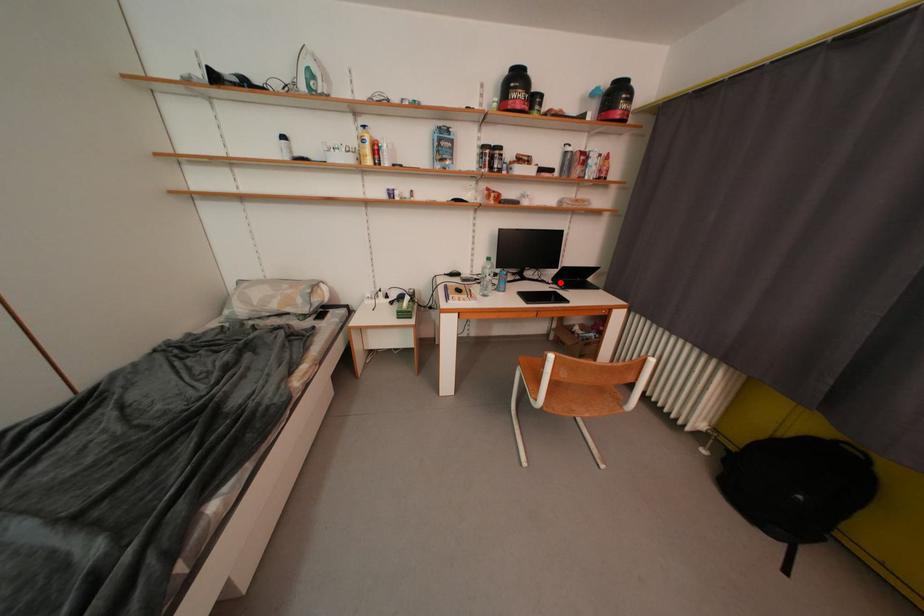
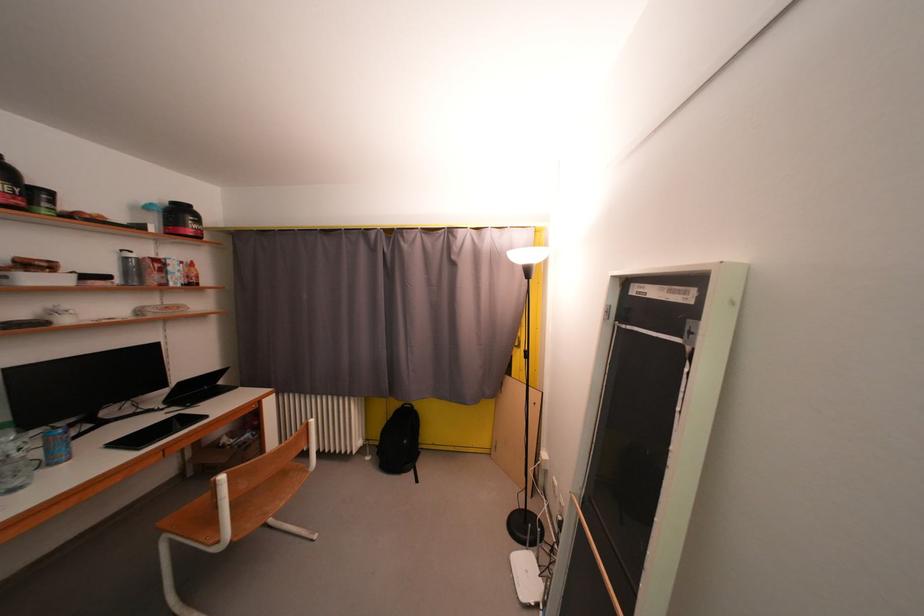
Question: I am providing you with two images of the same scene from different viewpoints. A red point is marked on the first image. Is the red point's position out of view in image 2?

Choices:
 (A) Yes
 (B) No

Answer: (B)